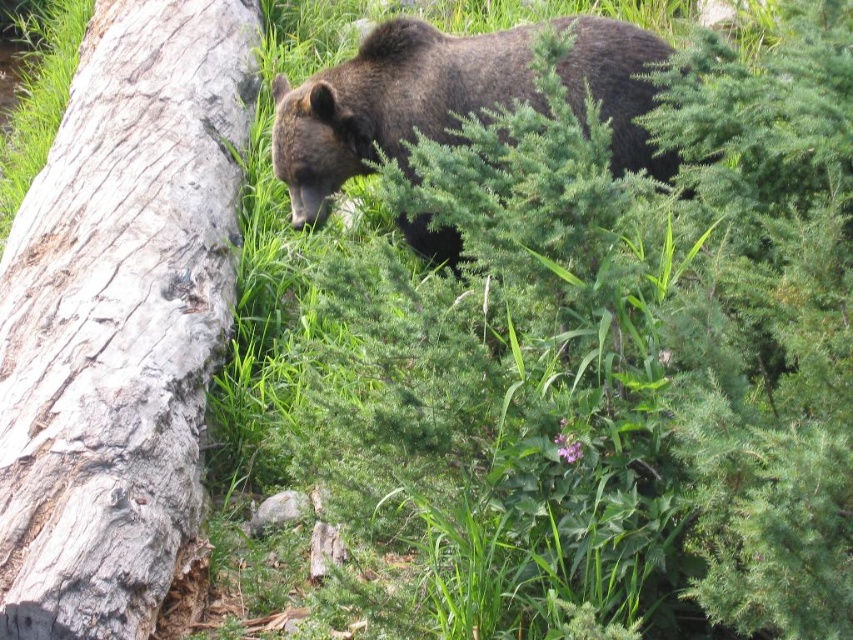
You are standing at point (380, 72) and want to reach point (7, 620). Given that the bear is between these two points, which direction should you move to avoid the bear?

You should move around the bear to reach point (7, 620) since it is in front of point (380, 72). However, the exact direction depends on the bear and surrounding obstacles not specified here.

You are standing in the outdoor area shown in the image. There is a point marked at coordinates (x=120, y=317). What object does this point correspond to?

The point corresponds to the gray rough bark tree trunk at left.